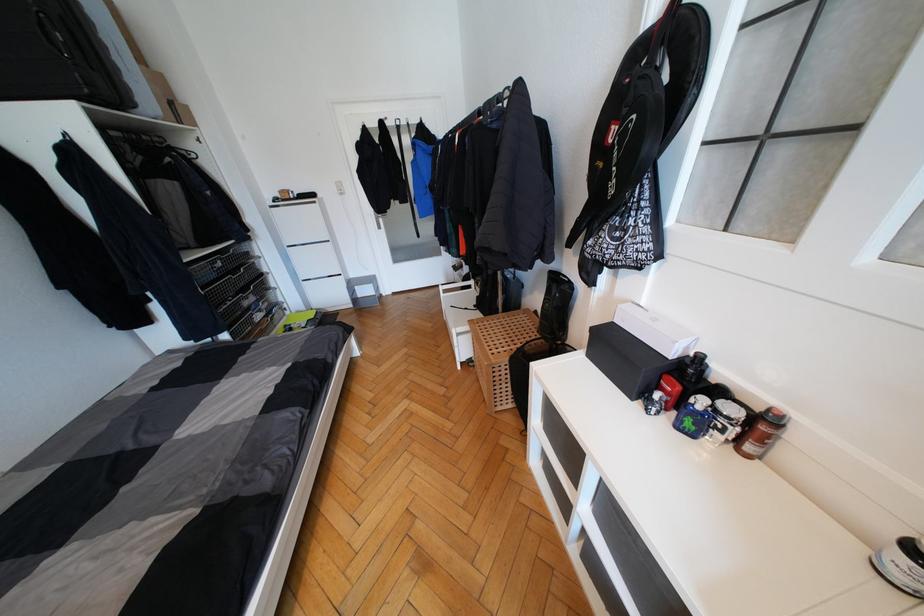
At what (x,y) coordinates should I click in order to perform the action: click on white rectangular box. Please return your answer as a coordinate pair (x, y). Looking at the image, I should click on (654, 330).